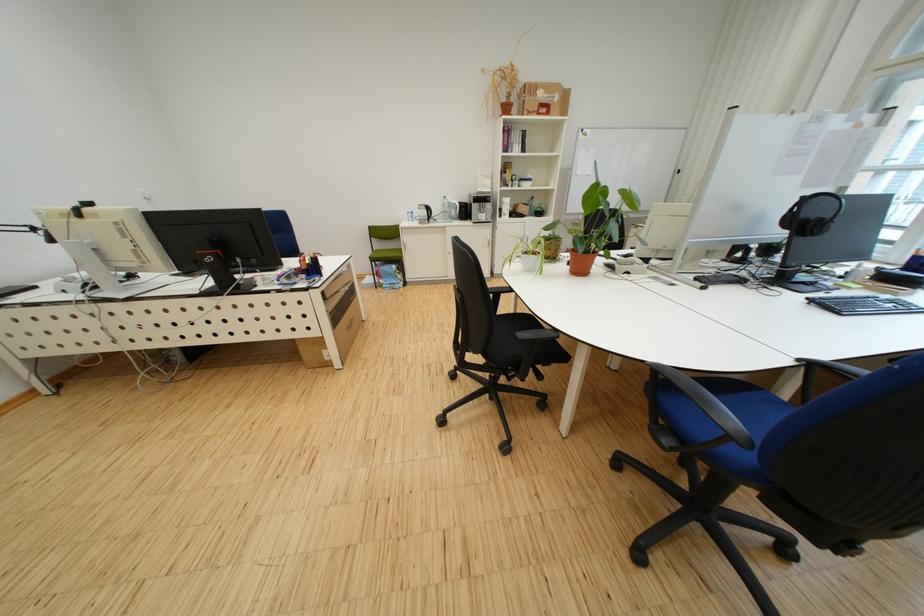
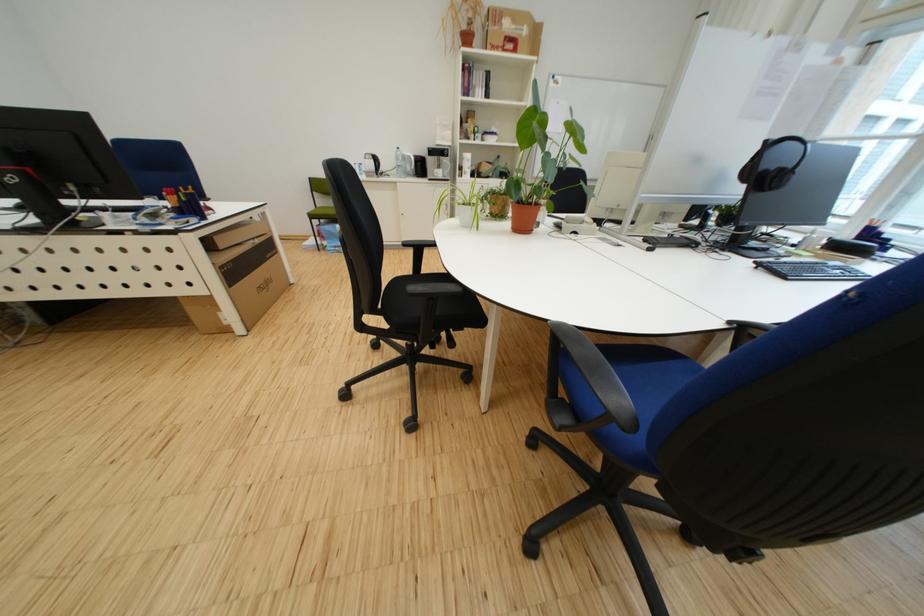
In the second image, find the point that corresponds to point (462, 206) in the first image.

(417, 159)